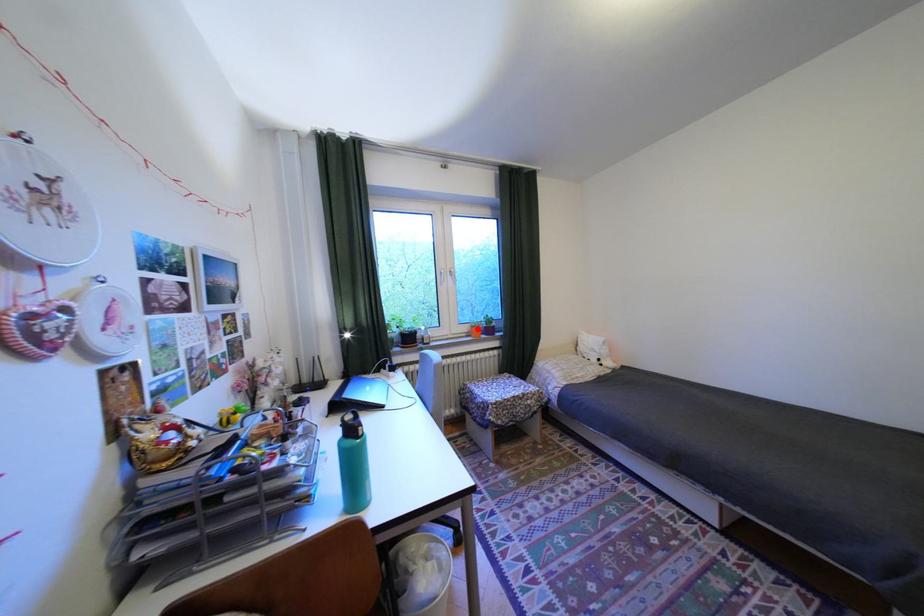
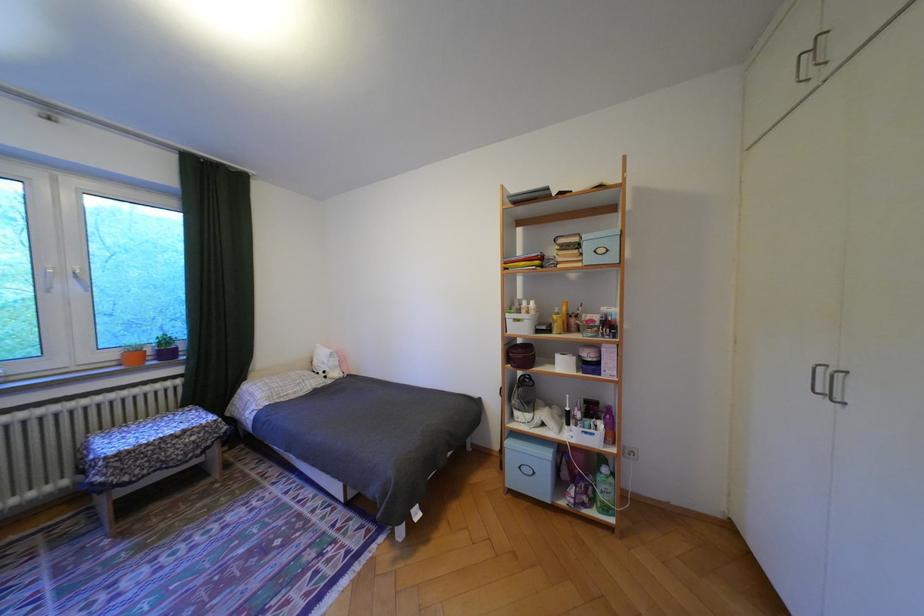
Locate, in the second image, the point that corresponds to the highlighted location in the first image.

(124, 355)